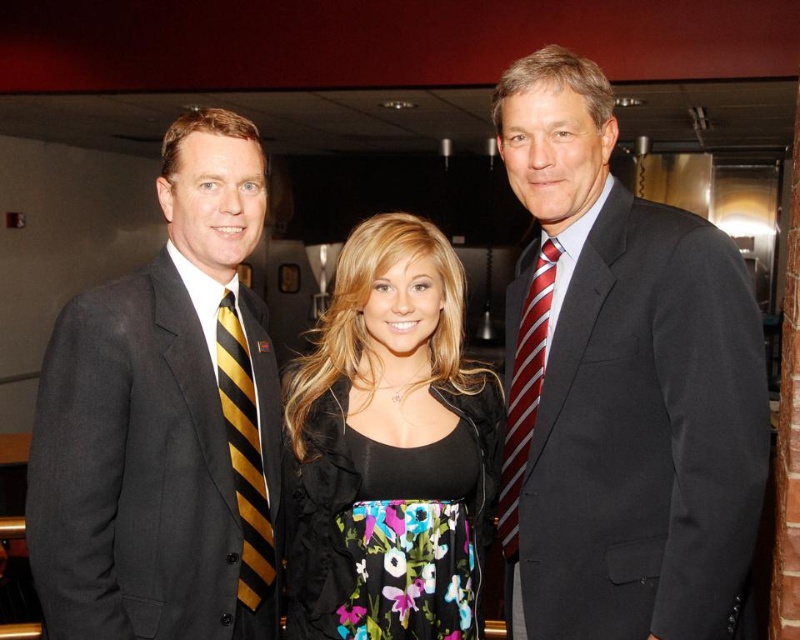
You are a photographer at a formal event. You need to adjust your camera focus to capture both the matte black suit at center and the red striped tie at right clearly. Based on their positions, which one should you focus on first to ensure both are in focus?

The matte black suit at center is located above the red striped tie at right, so focusing on the matte black suit at center first will help ensure both are in focus as they are aligned vertically.

You are taking a photo of two points in the scene. The first point is at coordinate point (102, 497) and the second is at point (249, 547). Which point will appear larger in your photo?

Point (102, 497) is closer to the camera than point (249, 547), so it will appear larger in the photo.